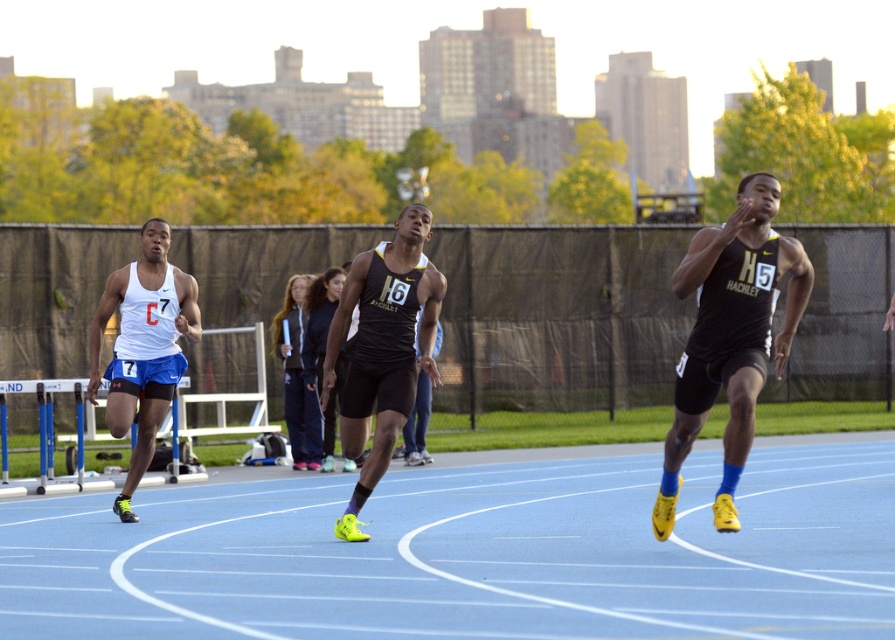
Question: Which object is positioned closest to the matte black singlet at center?

Choices:
 (A) blue rubber track at center
 (B) dark blue track pants at center

Answer: (A)

Question: Among these points, which one is farthest from the camera?

Choices:
 (A) (692, 269)
 (B) (374, 362)
 (C) (96, 372)

Answer: (C)

Question: Considering the relative positions of matte black singlet at center and white matte singlet at left in the image provided, where is matte black singlet at center located with respect to white matte singlet at left?

Choices:
 (A) below
 (B) above

Answer: (B)

Question: Which of the following is the closest to the observer?

Choices:
 (A) (833, 544)
 (B) (418, 260)
 (C) (286, 348)

Answer: (A)

Question: Is blue rubber track at center thinner than black matte running shoe at right?

Choices:
 (A) yes
 (B) no

Answer: (B)

Question: Can you confirm if white matte singlet at left is positioned to the left of dark blue track pants at center?

Choices:
 (A) yes
 (B) no

Answer: (A)